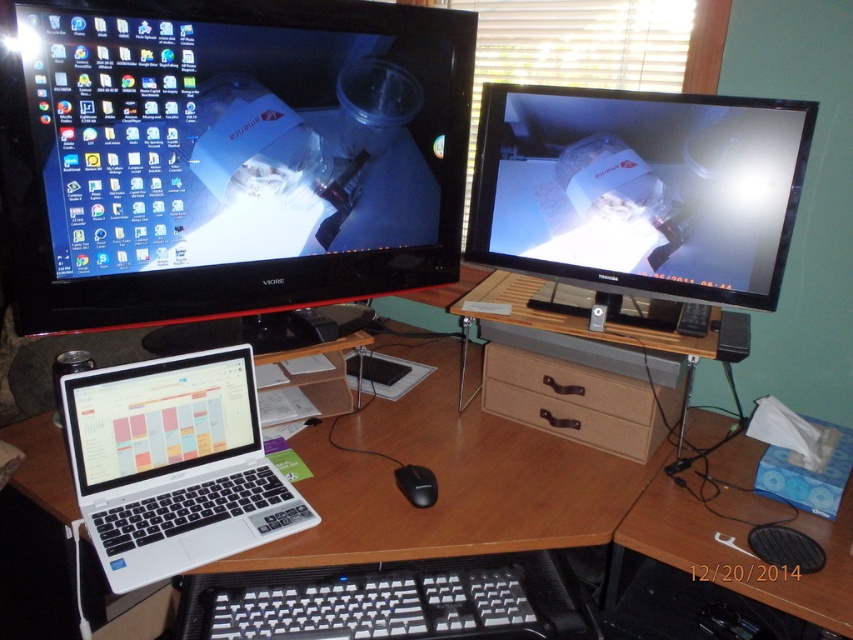
Question: Estimate the real-world distances between objects in this image. Which object is closer to the blue cardboard tissue box at lower right?

Choices:
 (A) black matte mouse at center
 (B) brown leather drawer at lower center
 (C) matte black monitor at upper left
 (D) satin black monitor at upper right

Answer: (B)

Question: Where is matte black monitor at upper left located in relation to black matte mouse at center in the image?

Choices:
 (A) above
 (B) below

Answer: (A)

Question: Is white plastic laptop at lower left to the left of black matte mouse at center from the viewer's perspective?

Choices:
 (A) no
 (B) yes

Answer: (B)

Question: Which point is farther to the camera?

Choices:
 (A) (512, 419)
 (B) (415, 468)
 (C) (556, 168)

Answer: (A)

Question: Considering the real-world distances, which object is farthest from the satin black monitor at upper right?

Choices:
 (A) blue cardboard tissue box at lower right
 (B) matte black monitor at upper left
 (C) brown leather drawer at lower center
 (D) white plastic laptop at lower left

Answer: (D)

Question: Can you confirm if satin black monitor at upper right is wider than blue cardboard tissue box at lower right?

Choices:
 (A) yes
 (B) no

Answer: (A)